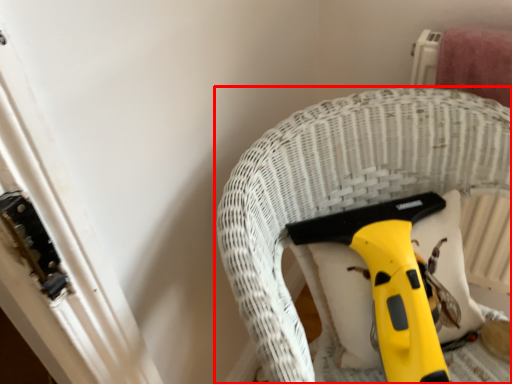
Question: From the image, what is the correct spatial relationship of furniture (annotated by the red box) in relation to tool?

Choices:
 (A) left
 (B) right

Answer: (B)